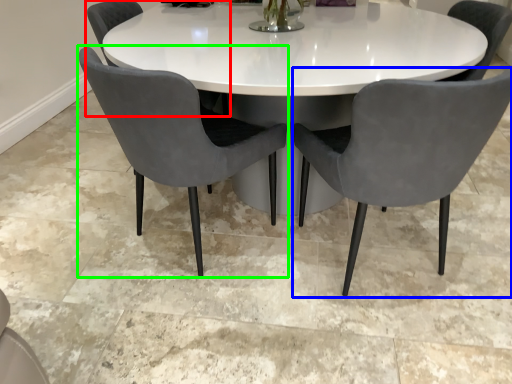
Question: Considering the real-world distances, which object is closest to chair (highlighted by a red box)? chair (highlighted by a blue box) or chair (highlighted by a green box).

Choices:
 (A) chair
 (B) chair

Answer: (B)